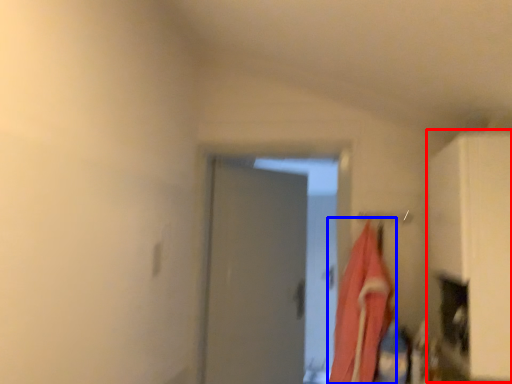
Question: Among these objects, which one is nearest to the camera, cabinetry (highlighted by a red box) or laundry (highlighted by a blue box)?

Choices:
 (A) cabinetry
 (B) laundry

Answer: (A)